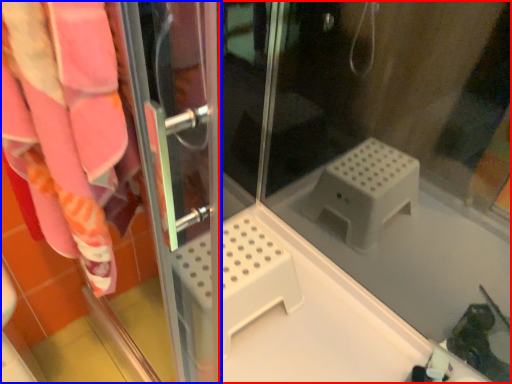
Question: Which of the following is the farthest to the observer, glass door (highlighted by a red box) or screen door (highlighted by a blue box)?

Choices:
 (A) glass door
 (B) screen door

Answer: (A)